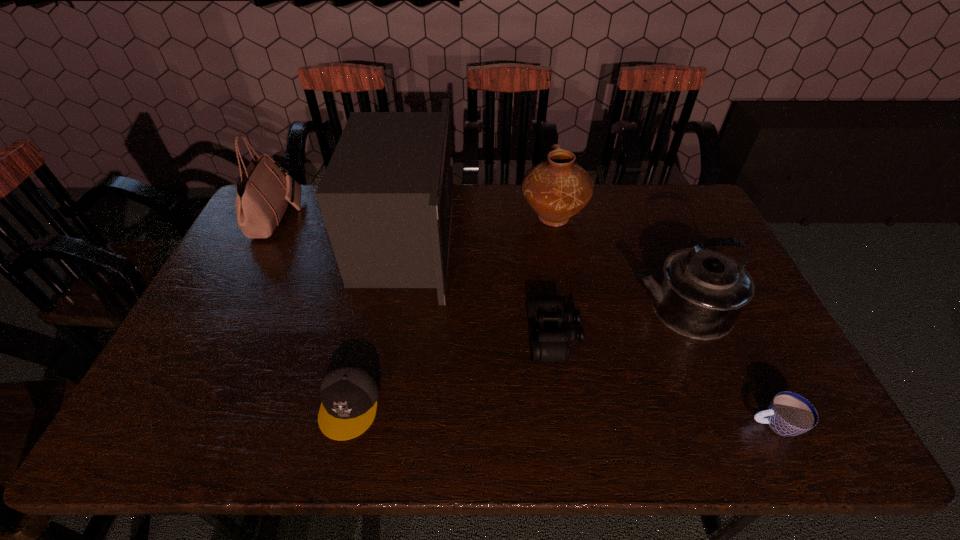
At what (x,y) coordinates should I click in order to perform the action: click on the fifth closest object to the leftmost object. Please return your answer as a coordinate pair (x, y). The width and height of the screenshot is (960, 540). Looking at the image, I should click on (700, 293).

You are a GUI agent. You are given a task and a screenshot of the screen. Output one action in this format:
    pyautogui.click(x=<x>, y=<y>)
    Task: Click on the object that is the closest one to the microwave oven
    
    Given the screenshot: What is the action you would take?
    pyautogui.click(x=349, y=392)

Where is `vacant area in the image that satisfies the following two spatial constraints: 1. at the eyepieces of the binoculars; 2. on the front-facing side of the cap`? This screenshot has width=960, height=540. vacant area in the image that satisfies the following two spatial constraints: 1. at the eyepieces of the binoculars; 2. on the front-facing side of the cap is located at coordinates (564, 404).